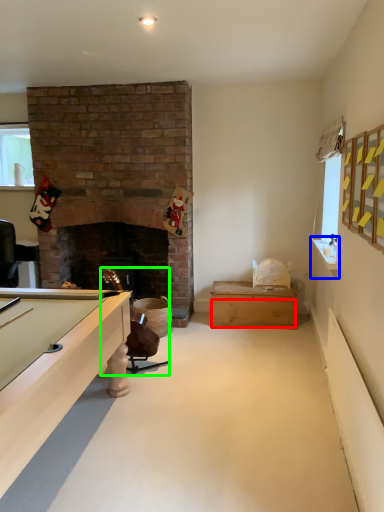
Question: Based on their relative distances, which object is farther from drawer (highlighted by a red box)? Choose from counter top (highlighted by a blue box) and chair (highlighted by a green box).

Choices:
 (A) counter top
 (B) chair

Answer: (A)